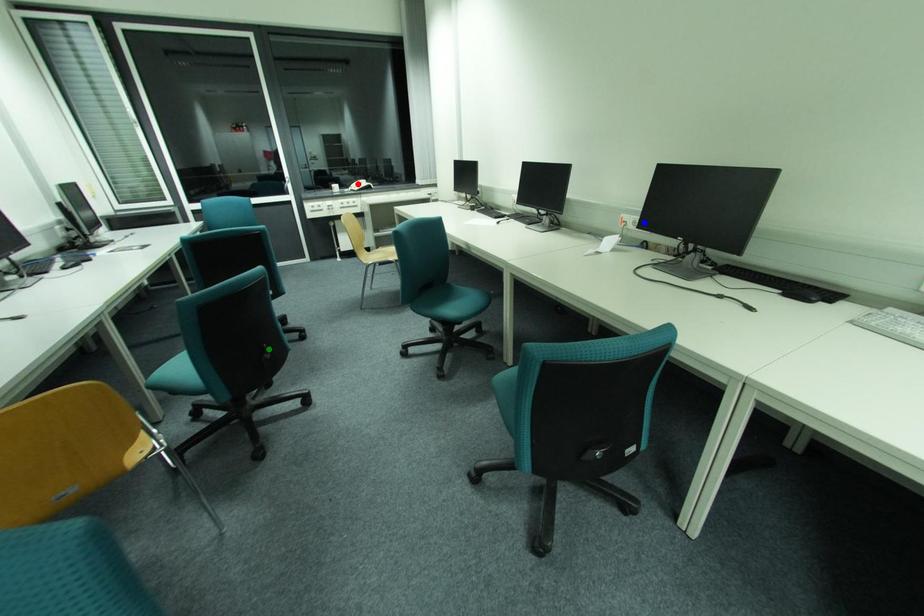
Order these from nearest to farthest:
A) red point
B) blue point
C) green point

blue point
green point
red point